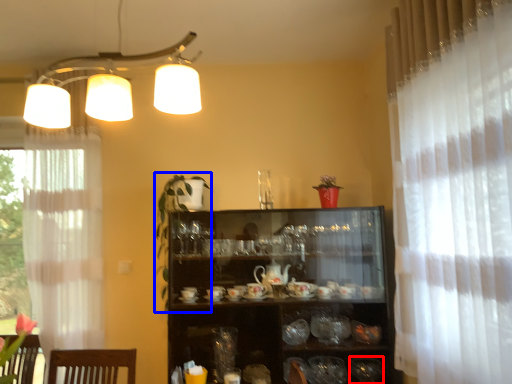
Question: Which point is closer to the camera, tableware (highlighted by a red box) or plant (highlighted by a blue box)?

Choices:
 (A) tableware
 (B) plant

Answer: (B)